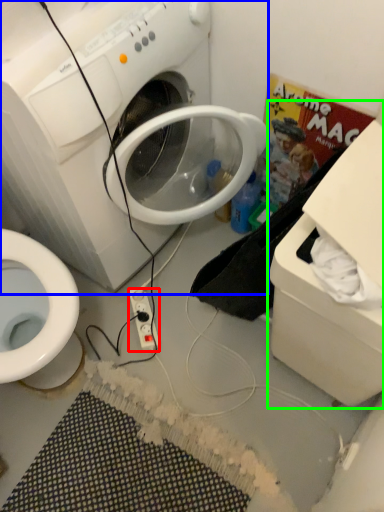
Question: Which object is positioned closest to power outlet (highlighted by a red box)? Select from washing machine (highlighted by a blue box) and cardboard box (highlighted by a green box).

Choices:
 (A) washing machine
 (B) cardboard box

Answer: (A)